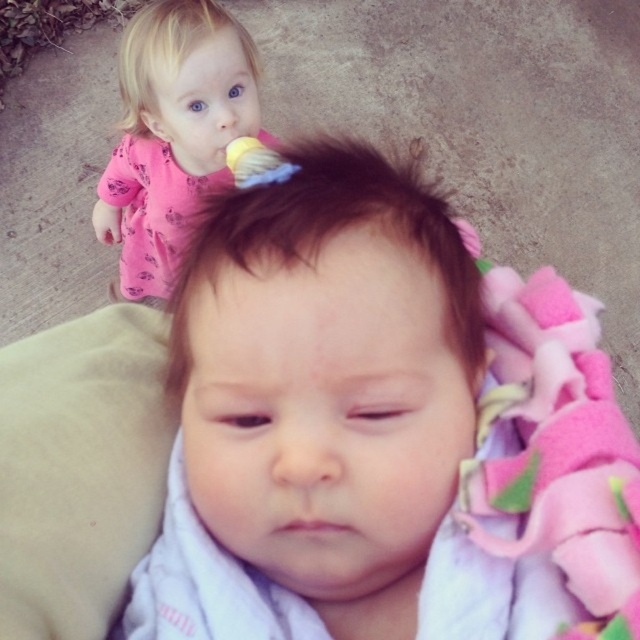
Question: Which of the following is the closest to the observer?

Choices:
 (A) pink fabric at upper left
 (B) soft pink blanket at center

Answer: (B)

Question: Which point is farther to the camera?

Choices:
 (A) pink fabric at upper left
 (B) soft pink blanket at center

Answer: (A)

Question: Is soft pink blanket at center in front of pink fabric at upper left?

Choices:
 (A) yes
 (B) no

Answer: (A)

Question: Which of the following is the farthest from the observer?

Choices:
 (A) (196, 160)
 (B) (497, 280)

Answer: (A)

Question: Can you confirm if soft pink blanket at center is smaller than pink fabric at upper left?

Choices:
 (A) no
 (B) yes

Answer: (B)

Question: Observing the image, what is the correct spatial positioning of soft pink blanket at center in reference to pink fabric at upper left?

Choices:
 (A) left
 (B) right

Answer: (B)